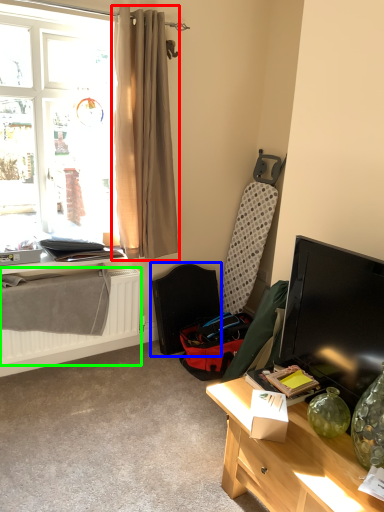
Question: Estimate the real-world distances between objects in this image. Which object is farther from curtain (highlighted by a red box), folding chair (highlighted by a blue box) or radiator (highlighted by a green box)?

Choices:
 (A) folding chair
 (B) radiator

Answer: (B)